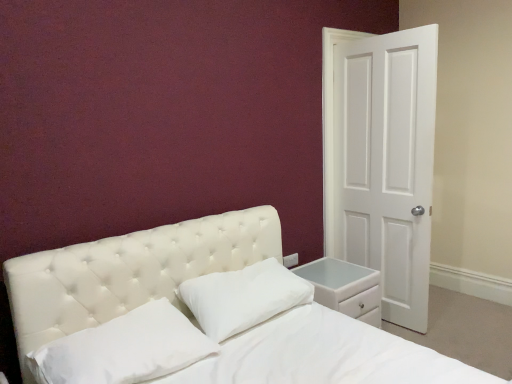
Question: Considering the relative positions of white leather nightstand at lower right and white soft pillow at center, which appears as the first pillow when viewed from the left, in the image provided, is white leather nightstand at lower right behind white soft pillow at center, which appears as the first pillow when viewed from the left,?

Choices:
 (A) no
 (B) yes

Answer: (B)

Question: Does white leather nightstand at lower right have a greater width compared to white soft pillow at center, which appears as the first pillow when viewed from the left?

Choices:
 (A) no
 (B) yes

Answer: (B)

Question: From a real-world perspective, is white leather nightstand at lower right positioned over white soft pillow at center, the second pillow in the right-to-left sequence, based on gravity?

Choices:
 (A) yes
 (B) no

Answer: (B)

Question: Is white leather nightstand at lower right at the left side of white soft pillow at center, which appears as the first pillow when viewed from the left?

Choices:
 (A) no
 (B) yes

Answer: (A)

Question: Is white leather nightstand at lower right turned away from white soft pillow at center, which appears as the first pillow when viewed from the left?

Choices:
 (A) no
 (B) yes

Answer: (A)

Question: Looking at the image, does white leather nightstand at lower right seem bigger or smaller compared to white soft pillow at center, which is the 2th pillow from left to right?

Choices:
 (A) big
 (B) small

Answer: (A)

Question: Relative to white soft pillow at center, which is the 2th pillow from left to right, is white leather nightstand at lower right in front or behind?

Choices:
 (A) behind
 (B) front

Answer: (A)

Question: From a real-world perspective, is white leather nightstand at lower right positioned above or below white soft pillow at center, which is the 2th pillow from left to right?

Choices:
 (A) above
 (B) below

Answer: (B)

Question: Considering the positions of white leather nightstand at lower right and white soft pillow at center, the 1th pillow positioned from the right, in the image, is white leather nightstand at lower right wider or thinner than white soft pillow at center, the 1th pillow positioned from the right,?

Choices:
 (A) wide
 (B) thin

Answer: (A)

Question: Looking at their shapes, would you say white soft pillow at center, the second pillow in the right-to-left sequence, is wider or thinner than white matte door at right?

Choices:
 (A) thin
 (B) wide

Answer: (B)

Question: Is white soft pillow at center, which appears as the first pillow when viewed from the left, inside or outside of white matte door at right?

Choices:
 (A) inside
 (B) outside

Answer: (B)

Question: Is white soft pillow at center, the second pillow in the right-to-left sequence, to the left or to the right of white matte door at right in the image?

Choices:
 (A) left
 (B) right

Answer: (A)

Question: Does point (120, 355) appear closer or farther from the camera than point (372, 200)?

Choices:
 (A) closer
 (B) farther

Answer: (A)

Question: Is point (221, 329) closer or farther from the camera than point (399, 241)?

Choices:
 (A) closer
 (B) farther

Answer: (A)

Question: Based on their sizes in the image, would you say white soft pillow at center, the 1th pillow positioned from the right, is bigger or smaller than white matte door at right?

Choices:
 (A) big
 (B) small

Answer: (B)